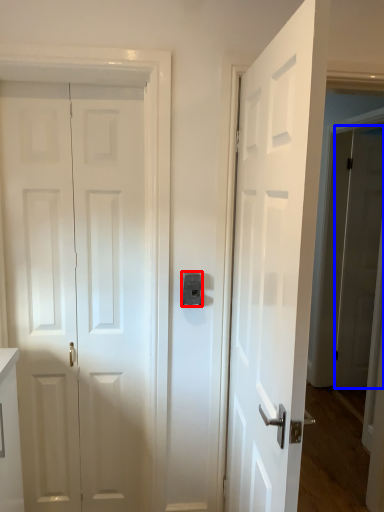
Question: Which point is further to the camera, latch (highlighted by a red box) or door (highlighted by a blue box)?

Choices:
 (A) latch
 (B) door

Answer: (B)